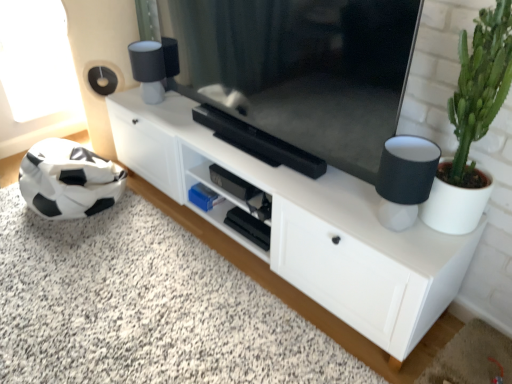
Locate an element on the screen. The height and width of the screenshot is (384, 512). blank space to the left of black fabric lampshade at right is located at coordinates (342, 216).